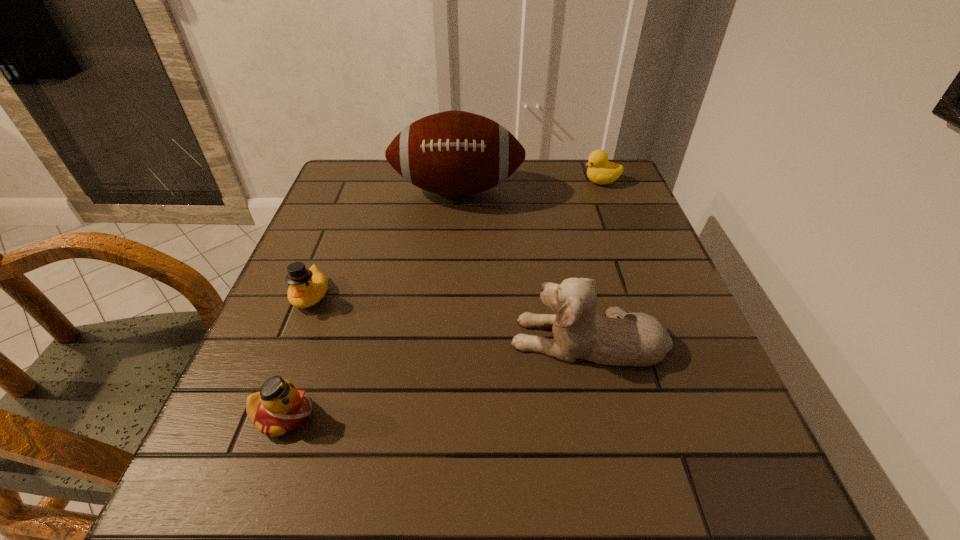
Where is `free point at the near edge`? This screenshot has width=960, height=540. free point at the near edge is located at coordinates (459, 501).

This screenshot has height=540, width=960. I want to click on vacant space at the left edge of the desktop, so click(x=291, y=339).

Where is `vacant space at the right edge of the desktop`? vacant space at the right edge of the desktop is located at coordinates (683, 345).

You are a GUI agent. You are given a task and a screenshot of the screen. Output one action in this format:
    pyautogui.click(x=<x>, y=<y>)
    Task: Click on the free space at the far left corner of the desktop
    The image size is (960, 540).
    Given the screenshot: What is the action you would take?
    click(x=359, y=172)

Identify the location of vacant area at the far right corner of the desktop. The image size is (960, 540). (627, 198).

In the image, there is a desktop. Identify the location of vacant space at the near right corner. (728, 519).

Identify the location of free spot between the second farthest duck and the football. (384, 243).

The width and height of the screenshot is (960, 540). I want to click on free area in between the tallest object and the fourth shortest object, so pyautogui.click(x=523, y=265).

Identify the location of free space between the tallest object and the rightmost duck. The width and height of the screenshot is (960, 540). (529, 186).

Locate an element on the screen. Image resolution: width=960 pixels, height=540 pixels. vacant point located between the second tallest object and the second farthest duck is located at coordinates (450, 317).